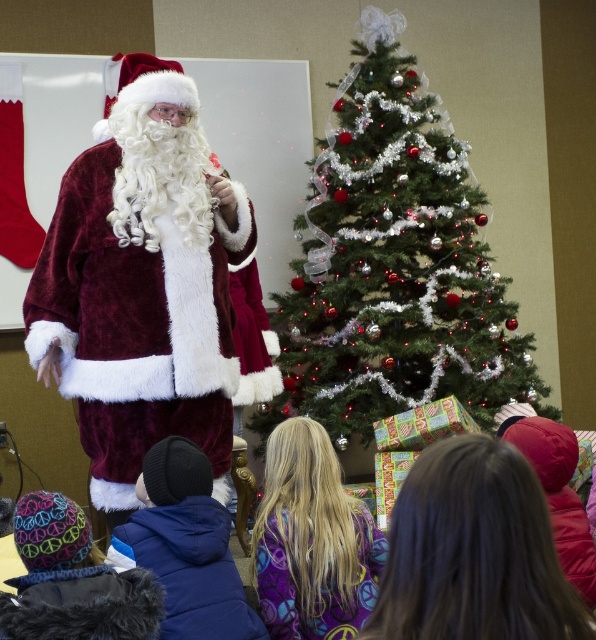
Question: Does shiny silver christmas tree at center appear under velvet maroon santa at left?

Choices:
 (A) no
 (B) yes

Answer: (A)

Question: Which point is closer to the camera?

Choices:
 (A) (66, 173)
 (B) (356, 312)
 (C) (290, 481)

Answer: (C)

Question: Which point is farther to the camera?

Choices:
 (A) shiny silver christmas tree at center
 (B) velvet maroon santa at left
 (C) purple fleece sweatshirt at lower center

Answer: (A)

Question: Which of the following is the closest to the observer?

Choices:
 (A) pos(408,282)
 (B) pos(290,435)
 (C) pos(98,468)

Answer: (B)

Question: Is shiny silver christmas tree at center wider than purple fleece sweatshirt at lower center?

Choices:
 (A) no
 (B) yes

Answer: (B)

Question: Does velvet maroon santa at left appear under purple fleece sweatshirt at lower center?

Choices:
 (A) yes
 (B) no

Answer: (B)